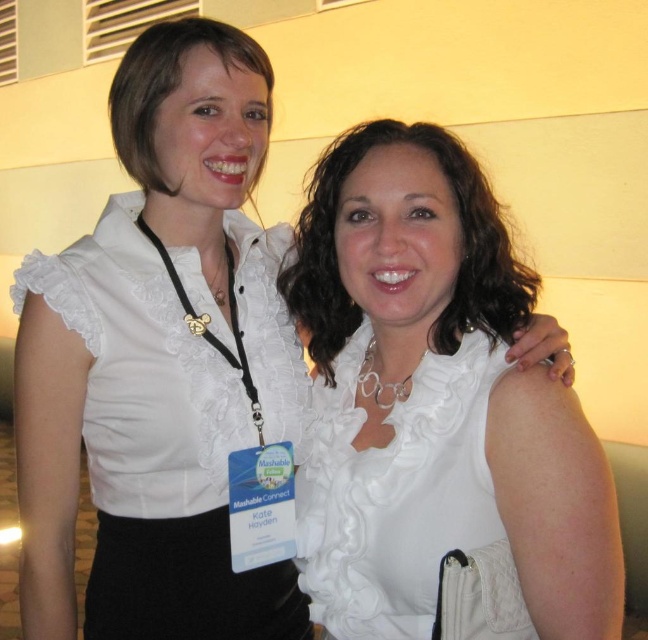
Question: Does white satin blouse at upper left appear on the left side of white satin dress at center?

Choices:
 (A) no
 (B) yes

Answer: (B)

Question: Is white satin blouse at center to the right of white satin dress at center from the viewer's perspective?

Choices:
 (A) yes
 (B) no

Answer: (B)

Question: Which of the following is the closest to the observer?

Choices:
 (A) white satin blouse at upper left
 (B) white satin dress at center

Answer: (B)

Question: Can you confirm if white satin blouse at center is positioned above white satin dress at center?

Choices:
 (A) yes
 (B) no

Answer: (A)

Question: Considering the real-world distances, which object is closest to the white satin blouse at center?

Choices:
 (A) white satin blouse at upper left
 (B) white satin dress at center

Answer: (B)

Question: Which point is farther to the camera?

Choices:
 (A) (380, 413)
 (B) (470, 408)

Answer: (A)